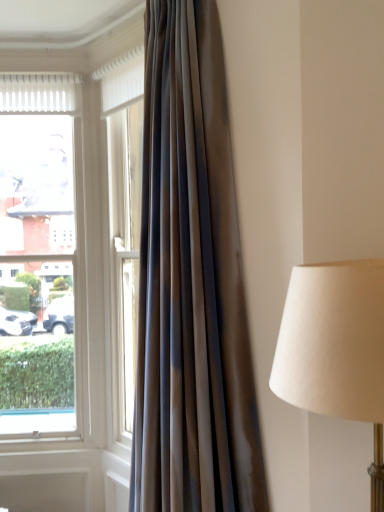
Question: Is clear glass window at left bigger or smaller than satin-like brown curtain at left?

Choices:
 (A) big
 (B) small

Answer: (B)

Question: In terms of height, does clear glass window at left look taller or shorter compared to satin-like brown curtain at left?

Choices:
 (A) short
 (B) tall

Answer: (A)

Question: From a real-world perspective, is clear glass window at left physically located above or below satin-like brown curtain at left?

Choices:
 (A) above
 (B) below

Answer: (B)

Question: In terms of height, does satin-like brown curtain at left look taller or shorter compared to clear glass window at left?

Choices:
 (A) short
 (B) tall

Answer: (B)

Question: Is point (162, 429) positioned closer to the camera than point (26, 129)?

Choices:
 (A) closer
 (B) farther

Answer: (A)

Question: Is satin-like brown curtain at left wider or thinner than clear glass window at left?

Choices:
 (A) thin
 (B) wide

Answer: (B)

Question: Based on their sizes in the image, would you say satin-like brown curtain at left is bigger or smaller than clear glass window at left?

Choices:
 (A) small
 (B) big

Answer: (B)